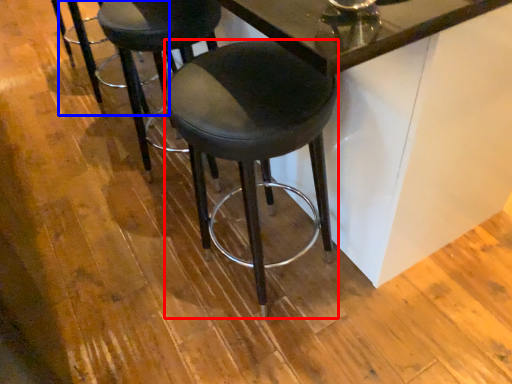
Question: Which object is closer to the camera taking this photo, stool (highlighted by a red box) or bar stool (highlighted by a blue box)?

Choices:
 (A) stool
 (B) bar stool

Answer: (A)